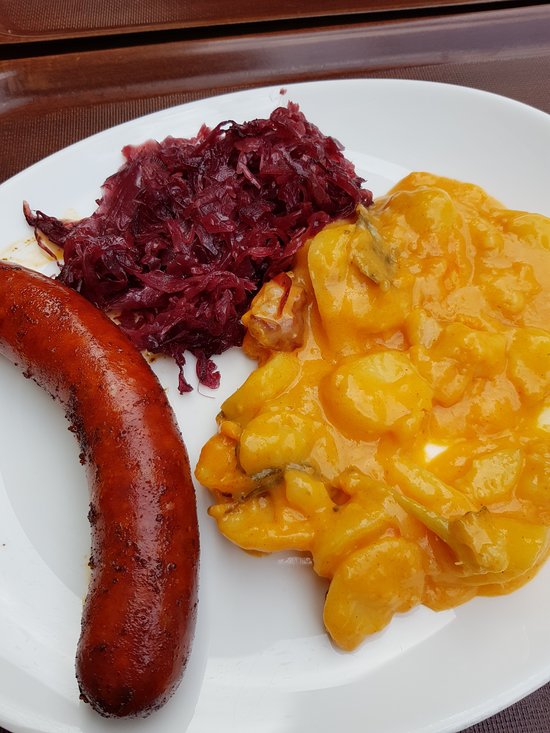
Find the location of `placemat`. placemat is located at coordinates (522, 712).